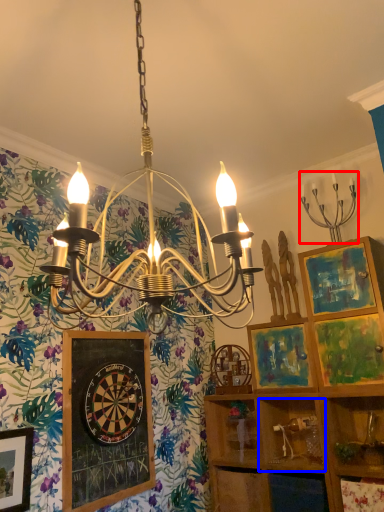
Question: Among these objects, which one is nearest to the camera, light fixture (highlighted by a red box) or cabinet (highlighted by a blue box)?

Choices:
 (A) light fixture
 (B) cabinet

Answer: (A)